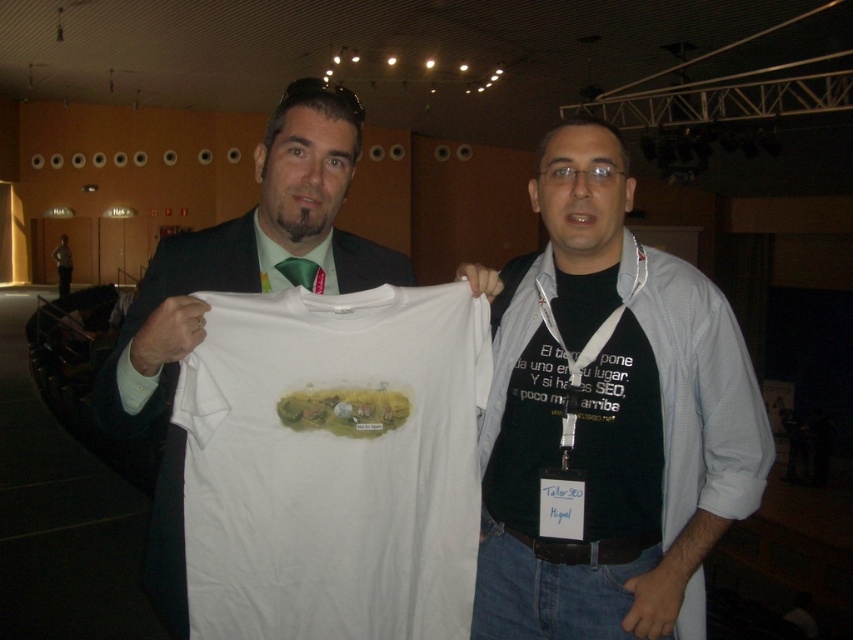
You are a photographer setting up for a photo shoot and need to ensure that both the black cotton shirt at center and the green silk tie at upper center are clearly visible in the frame. Based on their positions, which one might be partially obscured if you focus on the other?

The green silk tie at upper center might be partially obscured because the black cotton shirt at center is in front of it.

You are standing in the conference room and want to reach the point marked at coordinates (x=312, y=394). You have a 1.50 meter long measuring tape. If you extend it from your current position, will the tape be long enough to reach that point?

The distance between the point and the viewer is 1.40 meters. Since the measuring tape is 1.50 meters long, it will be sufficient to reach the point marked at coordinates (x=312, y=394).